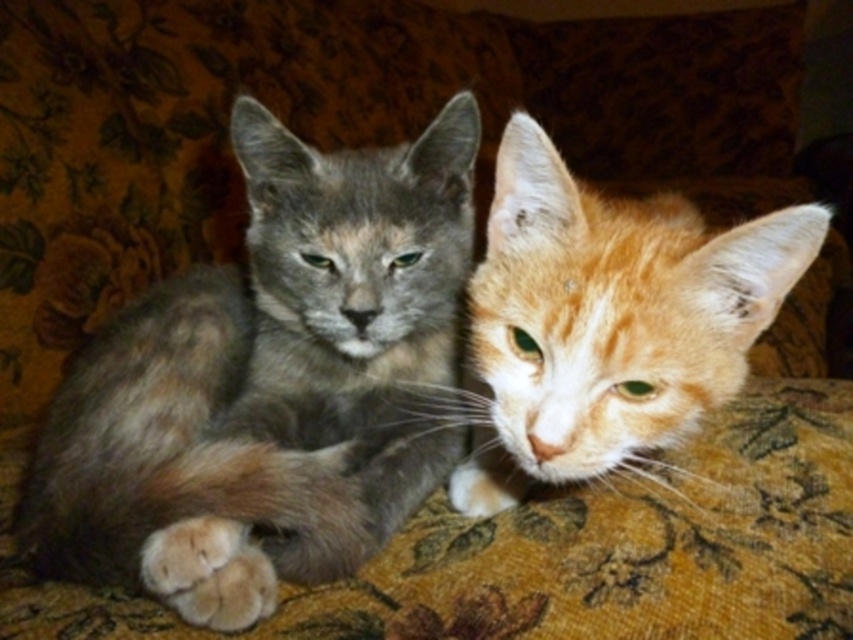
Question: Observing the image, what is the correct spatial positioning of gray fur cat at center in reference to orange fur cat at center?

Choices:
 (A) below
 (B) above

Answer: (A)

Question: Which point is farther to the camera?

Choices:
 (A) orange fur cat at center
 (B) gray fur cat at center

Answer: (B)

Question: Is gray fur cat at center behind orange fur cat at center?

Choices:
 (A) yes
 (B) no

Answer: (A)

Question: Which object appears closest to the camera in this image?

Choices:
 (A) orange fur cat at center
 (B) gray fur cat at center

Answer: (A)

Question: Is gray fur cat at center wider than orange fur cat at center?

Choices:
 (A) yes
 (B) no

Answer: (A)